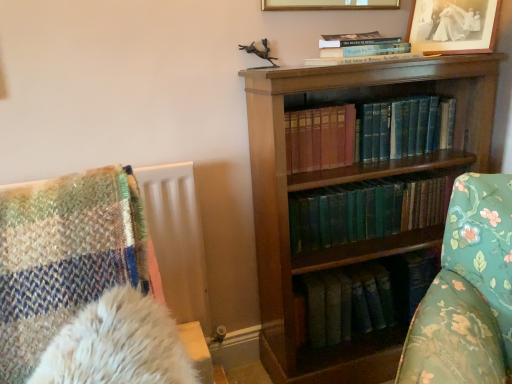
Question: Considering the positions of black paper picture frame at upper right, which ranks as the first picture frame in right-to-left order, and green leather book at center, the 1th book in the bottom-to-top sequence, in the image, is black paper picture frame at upper right, which ranks as the first picture frame in right-to-left order, bigger or smaller than green leather book at center, the 1th book in the bottom-to-top sequence,?

Choices:
 (A) big
 (B) small

Answer: (B)

Question: From the image's perspective, is black paper picture frame at upper right, which is the 2th picture frame from left to right, located above or below green leather book at center, positioned as the third book in top-to-bottom order?

Choices:
 (A) below
 (B) above

Answer: (B)

Question: Estimate the real-world distances between objects in this image. Which object is closer to the blue leather book at center, which is the 2th book from top to bottom?

Choices:
 (A) green leather book at center, the 1th book in the bottom-to-top sequence
 (B) black paper picture frame at upper right, which ranks as the first picture frame in right-to-left order
 (C) gold/glossy picture frame at upper center, the 2th picture frame when ordered from right to left
 (D) hardcover book at upper center, which is the first book from top to bottom
 (E) wooden bookcase at center

Answer: (A)

Question: Estimate the real-world distances between objects in this image. Which object is closer to the wooden bookcase at center?

Choices:
 (A) hardcover book at upper center, which is the first book from top to bottom
 (B) gold/glossy picture frame at upper center, which appears as the first picture frame when viewed from the left
 (C) blue leather book at center, the 2th book ordered from the bottom
 (D) green leather book at center, the 1th book in the bottom-to-top sequence
 (E) black paper picture frame at upper right, which ranks as the first picture frame in right-to-left order

Answer: (D)